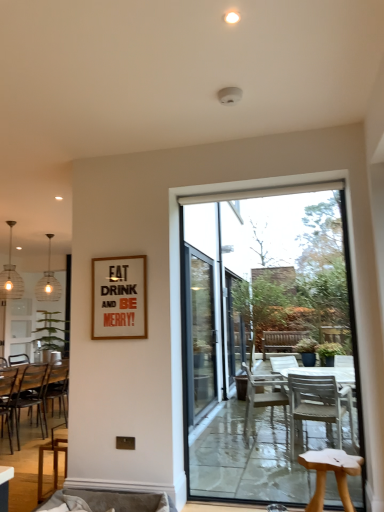
The height and width of the screenshot is (512, 384). Find the location of `wooden chair at lower left, the first chair positioned from the right`. wooden chair at lower left, the first chair positioned from the right is located at coordinates (53, 457).

The image size is (384, 512). Identify the location of wooden chair at left, acting as the 1th chair starting from the back. (35, 404).

The image size is (384, 512). Identify the location of wooden chair at left, which is counted as the first chair, starting from the left. [x=7, y=398].

Looking at this image, from the image's perspective, is light brown wooden stool at lower right located above matte glass pendant light at left, the 1th lamp when ordered from front to back?

No, from the image's perspective, light brown wooden stool at lower right is not above matte glass pendant light at left, the 1th lamp when ordered from front to back.

The height and width of the screenshot is (512, 384). I want to click on lamp that is the 1st one when counting backward from the light brown wooden stool at lower right, so click(10, 276).

Who is smaller, light brown wooden stool at lower right or matte glass pendant light at left, positioned as the 2th lamp in back-to-front order?

With smaller size is light brown wooden stool at lower right.

Looking at this image, is the depth of light brown wooden stool at lower right greater than that of matte glass pendant light at left, the 1th lamp when ordered from front to back?

No, it is not.

Would you say wooden chair at left, which is the 2th chair from right to left, is to the left or to the right of transparent glass door at center in the picture?

wooden chair at left, which is the 2th chair from right to left, is to the left of transparent glass door at center.

Considering the relative sizes of wooden chair at left, which appears as the second chair when viewed from the left, and transparent glass door at center in the image provided, is wooden chair at left, which appears as the second chair when viewed from the left, shorter than transparent glass door at center?

Correct, wooden chair at left, which appears as the second chair when viewed from the left, is not as tall as transparent glass door at center.

From a real-world perspective, which is physically below, wooden chair at left, which is the 2th chair from right to left, or transparent glass door at center?

From a 3D spatial view, wooden chair at left, which is the 2th chair from right to left, is below.

Is wooden chair at left, which appears as the second chair when viewed from the left, positioned behind transparent glass door at center?

Yes, wooden chair at left, which appears as the second chair when viewed from the left, is further from the camera.

Does point (122, 284) come behind point (16, 278)?

That is False.

Which of these two, wooden frame at upper center or matte glass pendant light at left, positioned as the 2th lamp in back-to-front order, stands shorter?

wooden frame at upper center.

Find the location of a particular element. The height and width of the screenshot is (512, 384). the 2nd lamp positioned above the wooden frame at upper center (from the image's perspective) is located at coordinates (10, 276).

Who is smaller, wooden frame at upper center or matte glass pendant light at left, positioned as the 2th lamp in back-to-front order?

wooden frame at upper center.

From a real-world perspective, is velvet beige couch at lower center on top of green leafy plant at left?

No, from a real-world perspective, velvet beige couch at lower center is not above green leafy plant at left.

Is point (112, 502) closer or farther from the camera than point (44, 344)?

Point (112, 502) is closer to the camera than point (44, 344).

Would you say velvet beige couch at lower center is outside green leafy plant at left?

That's correct, velvet beige couch at lower center is outside of green leafy plant at left.

From the image's perspective, is velvet beige couch at lower center over green leafy plant at left?

No, from the image's perspective, velvet beige couch at lower center is not above green leafy plant at left.

Can you confirm if wooden frame at upper center is wider than wooden chair at lower left, the 3th chair when ordered from left to right?

No.

What's the angular difference between wooden frame at upper center and wooden chair at lower left, the first chair positioned from the right,'s facing directions?

The angular difference between wooden frame at upper center and wooden chair at lower left, the first chair positioned from the right, is 92.8 degrees.

From the image's perspective, which chair is the 2nd one below the wooden frame at upper center? Please provide its 2D coordinates.

[(53, 457)]

From a real-world perspective, who is located lower, wooden chair at lower left, the first chair positioned from the right, or wooden frame at upper center?

wooden chair at lower left, the first chair positioned from the right, is physically lower.

Based on the photo, could you measure the distance between wooden chair at lower left, the 3th chair when ordered from left to right, and wooden frame at upper center?

They are 3.97 feet apart.

Is wooden chair at lower left, the 3th chair when ordered from left to right, directly adjacent to wooden frame at upper center?

There is a gap between wooden chair at lower left, the 3th chair when ordered from left to right, and wooden frame at upper center.

Is wooden frame at upper center surrounded by wooden chair at lower left, the first chair positioned from the right?

No.

Based on the photo, from a real-world perspective, is matte glass pendant light at left, positioned as the 2th lamp in back-to-front order, beneath wooden chair at left, which is counted as the first chair, starting from the left?

No.

In the scene shown: Is matte glass pendant light at left, positioned as the 2th lamp in back-to-front order, to the left or to the right of wooden chair at left, placed as the second chair when sorted from front to back, in the image?

From the image, it's evident that matte glass pendant light at left, positioned as the 2th lamp in back-to-front order, is to the left of wooden chair at left, placed as the second chair when sorted from front to back.

Looking at this image, is matte glass pendant light at left, the 1th lamp when ordered from front to back, not near wooden chair at left, placed as the second chair when sorted from front to back?

Yes, matte glass pendant light at left, the 1th lamp when ordered from front to back, and wooden chair at left, placed as the second chair when sorted from front to back, are located far from each other.

You are a GUI agent. You are given a task and a screenshot of the screen. Output one action in this format:
    pyautogui.click(x=<x>, y=<y>)
    Task: Click on the stool on the right of matte glass pendant light at left, positioned as the 2th lamp in back-to-front order
    The height and width of the screenshot is (512, 384).
    Given the screenshot: What is the action you would take?
    pyautogui.click(x=334, y=472)

From the image's perspective, count 3rd chairs downward from the transparent glass door at center and point to it. Please provide its 2D coordinates.

[(35, 404)]

When comparing their distances from light brown wooden stool at lower right, does velvet beige couch at lower center or wooden chair at lower left, which appears as the 1th chair when viewed from the front, seem closer?

The object closer to light brown wooden stool at lower right is velvet beige couch at lower center.

From the image, which object appears to be farther from green leafy plant at left, wooden chair at left, which is the 2th chair from right to left, or matte glass pendant light at left, the 1th lamp when ordered from front to back?

Among the two, wooden chair at left, which is the 2th chair from right to left, is located further to green leafy plant at left.

Which object lies further to the anchor point transparent glass door at center, light brown wooden stool at lower right or wooden chair at left, acting as the 1th chair starting from the back?

wooden chair at left, acting as the 1th chair starting from the back, is further to transparent glass door at center.

Based on the photo, estimate the real-world distances between objects in this image. Which object is further from wooden chair at left, the 3th chair in the right-to-left sequence, velvet beige couch at lower center or wooden frame at upper center?

Based on the image, wooden frame at upper center appears to be further to wooden chair at left, the 3th chair in the right-to-left sequence.

Looking at this image, estimate the real-world distances between objects in this image. Which object is further from transparent glass door at center, wooden chair at lower left, which appears as the 1th chair when viewed from the front, or clear glass pendant light at left, which ranks as the second lamp in front-to-back order?

clear glass pendant light at left, which ranks as the second lamp in front-to-back order, lies further to transparent glass door at center than the other object.

Estimate the real-world distances between objects in this image. Which object is closer to light brown wooden stool at lower right, wooden chair at left, placed as the second chair when sorted from front to back, or wooden chair at lower left, the first chair positioned from the right?

The object closer to light brown wooden stool at lower right is wooden chair at lower left, the first chair positioned from the right.

Considering their positions, is clear glass pendant light at left, which ranks as the second lamp in front-to-back order, positioned closer to wooden chair at left, which appears as the second chair when viewed from the left, than velvet beige couch at lower center?

Among the two, clear glass pendant light at left, which ranks as the second lamp in front-to-back order, is located nearer to wooden chair at left, which appears as the second chair when viewed from the left.

Based on their spatial positions, is light brown wooden stool at lower right or green leafy plant at left further from wooden chair at left, placed as the second chair when sorted from front to back?

light brown wooden stool at lower right.

At what (x,y) coordinates should I click in order to perform the action: click on picture frame between light brown wooden stool at lower right and green leafy plant at left along the z-axis. Please return your answer as a coordinate pair (x, y). The width and height of the screenshot is (384, 512). Looking at the image, I should click on (119, 298).

The width and height of the screenshot is (384, 512). I want to click on lamp between light brown wooden stool at lower right and clear glass pendant light at left, which appears as the first lamp when viewed from the back, from front to back, so click(x=10, y=276).

Where is `chair between velvet beige couch at lower center and wooden chair at left, which is counted as the first chair, starting from the left, from front to back`? chair between velvet beige couch at lower center and wooden chair at left, which is counted as the first chair, starting from the left, from front to back is located at coordinates (53, 457).

You are a GUI agent. You are given a task and a screenshot of the screen. Output one action in this format:
    pyautogui.click(x=<x>, y=<y>)
    Task: Click on the window positioned between velvet beige couch at lower center and clear glass pendant light at left, which appears as the first lamp when viewed from the back, from near to far
    The width and height of the screenshot is (384, 512).
    Given the screenshot: What is the action you would take?
    pyautogui.click(x=265, y=340)